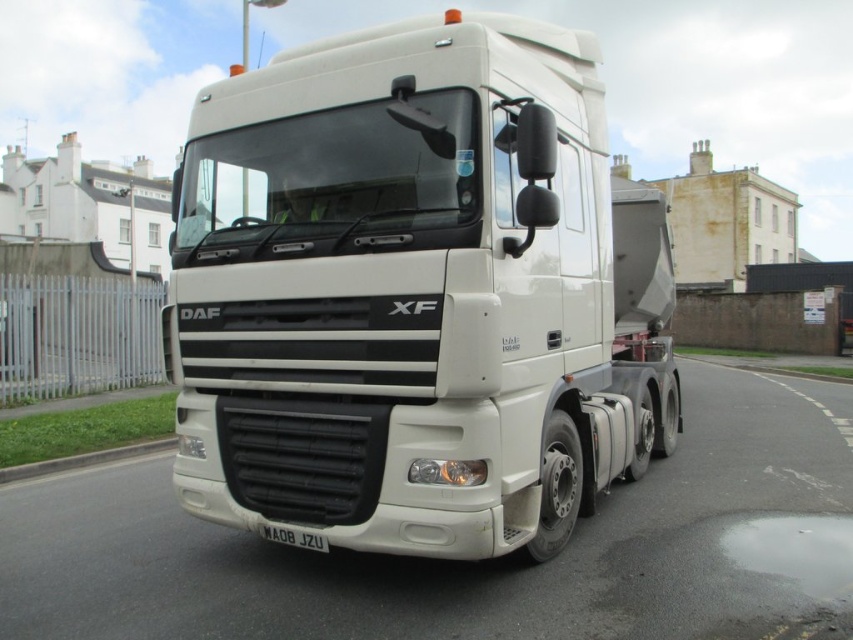
Question: Which object appears closest to the camera in this image?

Choices:
 (A) white matte trailer truck at center
 (B) white matte license plate at center

Answer: (A)

Question: Is white matte trailer truck at center further to the viewer compared to white matte license plate at center?

Choices:
 (A) no
 (B) yes

Answer: (A)

Question: Can you confirm if white matte trailer truck at center is thinner than white matte license plate at center?

Choices:
 (A) yes
 (B) no

Answer: (A)

Question: Among these objects, which one is farthest from the camera?

Choices:
 (A) white matte trailer truck at center
 (B) white matte license plate at center

Answer: (B)

Question: Is white matte trailer truck at center bigger than white matte license plate at center?

Choices:
 (A) yes
 (B) no

Answer: (A)